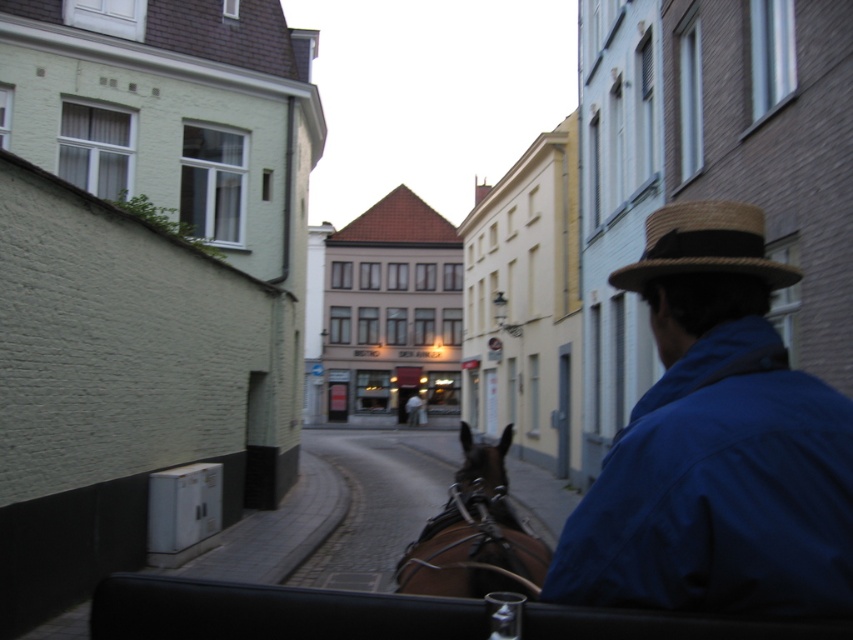
You are a passenger in the horse carriage and want to know which object takes up more space in your view. Which one is larger in the scene between the blue cotton jacket at right and the brown leather horse at center?

The brown leather horse at center occupies more space than the blue cotton jacket at right in the scene.

You are a passenger in the horse carriage and want to see the street sign ahead. You notice the blue cotton jacket at right and the natural straw hat at upper right. Which object is taller and would block your view less if you look over it?

The blue cotton jacket at right is taller than the natural straw hat at upper right, so looking over the natural straw hat at upper right would block your view less.

You are a passenger in the horse carriage and want to hand a map to the driver who is wearing the natural straw hat at upper right. Can you reach the driver by extending your arm from your seat in the brown leather horse at center? Please explain your reasoning.

The brown leather horse at center is further to the viewer than the natural straw hat at upper right. Since the horse is closer to you, the driver wearing the natural straw hat at upper right is farther away. Therefore, you might not be able to reach them by extending your arm from your seat in the brown leather horse at center.